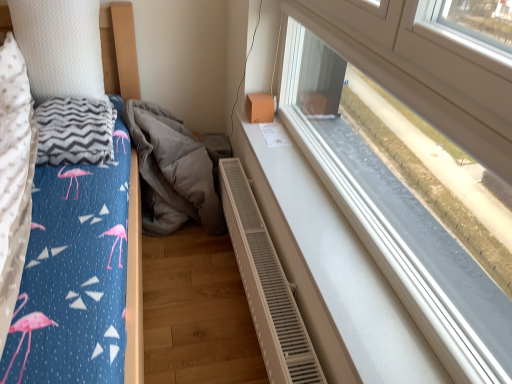
Locate an element on the screen. The width and height of the screenshot is (512, 384). free location above white textured radiator at lower center (from a real-world perspective) is located at coordinates (278, 283).